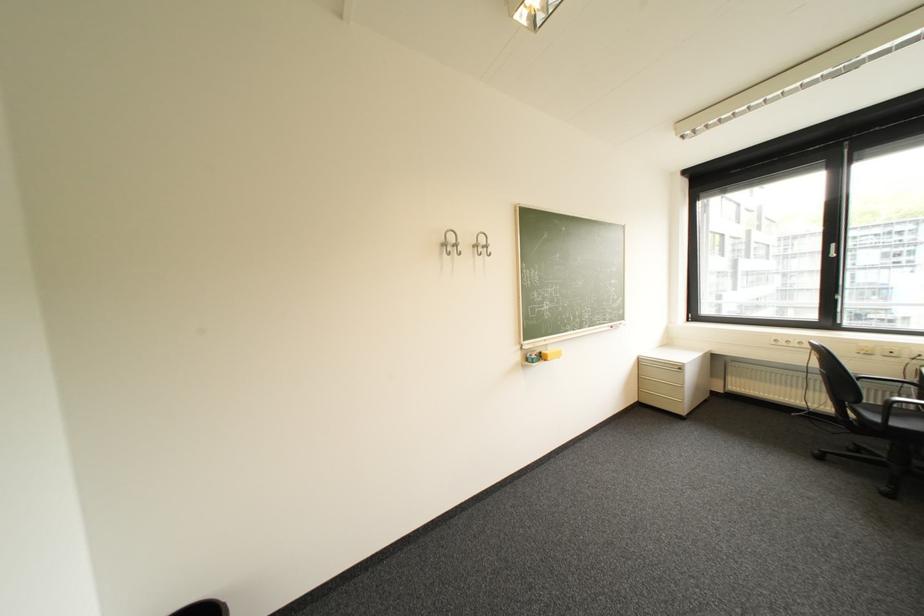
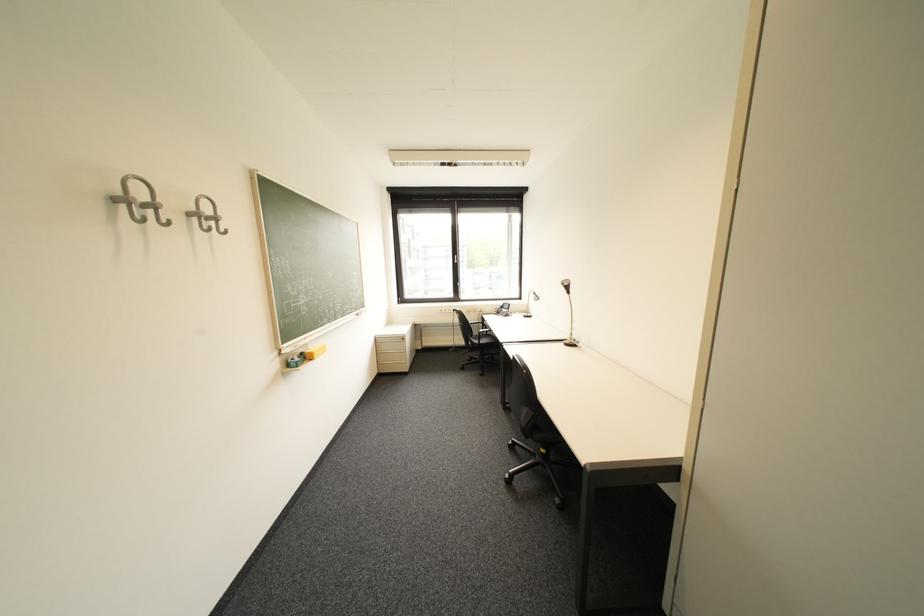
The point at (x=543, y=357) is marked in the first image. Where is the corresponding point in the second image?

(308, 360)